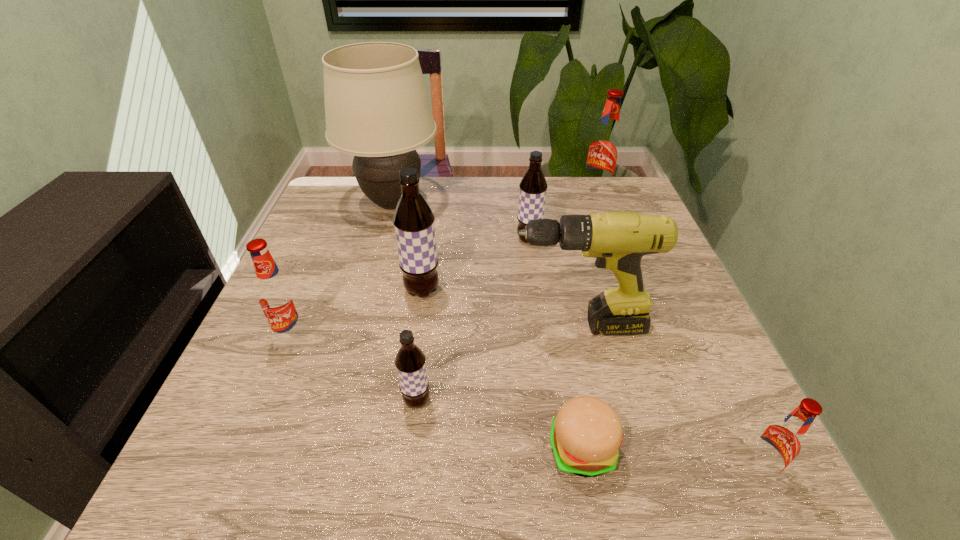
Locate an element on the screen. free space that satisfies the following two spatial constraints: 1. on the front side of the fourth farthest root beer; 2. on the right side of the second nearest root beer is located at coordinates (268, 401).

Locate an element on the screen. The height and width of the screenshot is (540, 960). free space that satisfies the following two spatial constraints: 1. on the front side of the beige hamburger; 2. on the right side of the fourth nearest root beer is located at coordinates (400, 449).

The width and height of the screenshot is (960, 540). Identify the location of free location that satisfies the following two spatial constraints: 1. on the front side of the rightmost red root beer; 2. on the left side of the lampshade. point(322,469).

Where is `free spot that satisfies the following two spatial constraints: 1. on the front side of the tallest object; 2. on the left side of the biggest brown root beer`? The height and width of the screenshot is (540, 960). free spot that satisfies the following two spatial constraints: 1. on the front side of the tallest object; 2. on the left side of the biggest brown root beer is located at coordinates (370, 291).